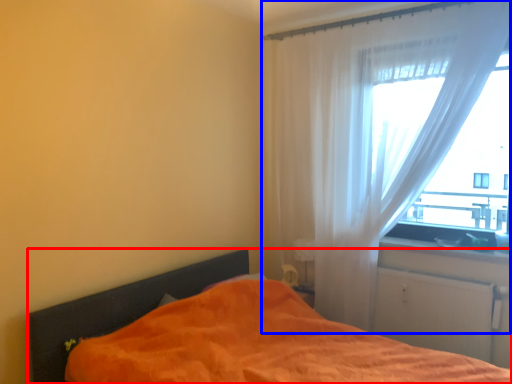
Question: Which point is closer to the camera, bed (highlighted by a red box) or curtain (highlighted by a blue box)?

Choices:
 (A) bed
 (B) curtain

Answer: (A)